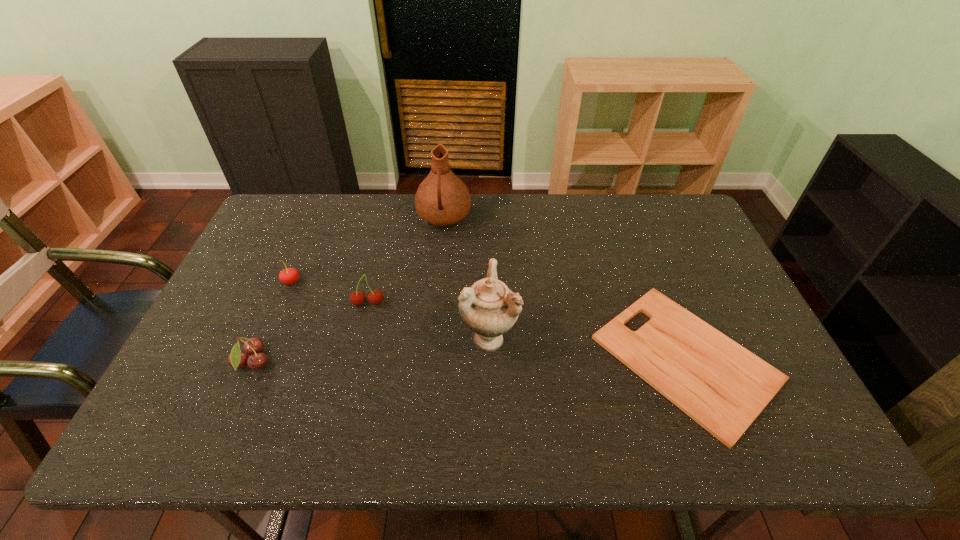
Locate an element on the screen. vacant area that lies between the farthest cherry and the urn is located at coordinates tap(390, 310).

Image resolution: width=960 pixels, height=540 pixels. I want to click on free space between the urn and the second farthest cherry, so click(x=428, y=321).

Locate an element on the screen. Image resolution: width=960 pixels, height=540 pixels. vacant region between the urn and the nearest cherry is located at coordinates (371, 350).

The image size is (960, 540). Identify the location of empty space between the nearest cherry and the pitcher. (348, 291).

Locate which object ranks fourth in proximity to the farthest object. Please provide its 2D coordinates. Your answer should be formatted as a tuple, i.e. [(x, y)], where the tuple contains the x and y coordinates of a point satisfying the conditions above.

[(721, 385)]

Find the location of a particular element. The width and height of the screenshot is (960, 540). the fourth closest object relative to the urn is located at coordinates (254, 346).

Choose which cherry is the second nearest neighbor to the nearest cherry. Please provide its 2D coordinates. Your answer should be formatted as a tuple, i.e. [(x, y)], where the tuple contains the x and y coordinates of a point satisfying the conditions above.

[(288, 276)]

You are a GUI agent. You are given a task and a screenshot of the screen. Output one action in this format:
    pyautogui.click(x=<x>, y=<y>)
    Task: Click on the cherry that is the closest to the rightmost object
    This screenshot has height=540, width=960.
    Given the screenshot: What is the action you would take?
    pyautogui.click(x=376, y=297)

What are the coordinates of `vacant area in the image that satisfies the following two spatial constraints: 1. on the side of the farthest object with the handle; 2. on the leaves of the nearest cherry` in the screenshot? It's located at (430, 363).

Locate an element on the screen. The width and height of the screenshot is (960, 540). vacant space that satisfies the following two spatial constraints: 1. on the surface of the tallest cherry; 2. on the right side of the shortest object is located at coordinates (355, 359).